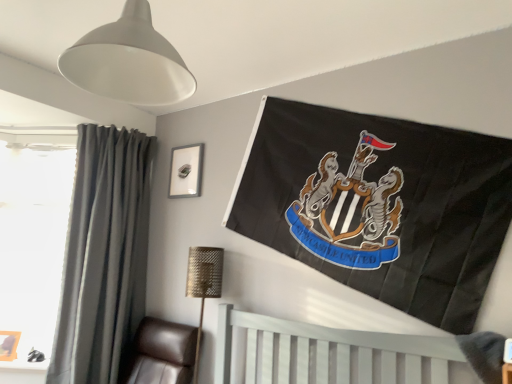
Question: Is white matte lampshade at upper left, the 2th lamp positioned from the back, in front of or behind transparent glass window at left in the image?

Choices:
 (A) behind
 (B) front

Answer: (B)

Question: Is point (81, 44) closer or farther from the camera than point (23, 210)?

Choices:
 (A) closer
 (B) farther

Answer: (A)

Question: Based on their relative distances, which object is nearer to the white painted wood bed at lower center?

Choices:
 (A) transparent glass window at left
 (B) white matte lampshade at upper left, the 2th lamp positioned from the back
 (C) dark gray fabric curtain at left
 (D) wooden picture frame at lower left, which appears as the 1th picture frame when viewed from the left
 (E) metallic silver picture frame at upper center, positioned as the second picture frame in left-to-right order

Answer: (C)

Question: Estimate the real-world distances between objects in this image. Which object is closer to the white painted wood bed at lower center?

Choices:
 (A) wooden picture frame at lower left, positioned as the 1th picture frame in bottom-to-top order
 (B) gold textured lamp at lower center, which ranks as the 2th lamp in front-to-back order
 (C) transparent glass window at left
 (D) white matte lampshade at upper left, which is the first lamp in top-to-bottom order
 (E) dark gray fabric curtain at left

Answer: (B)